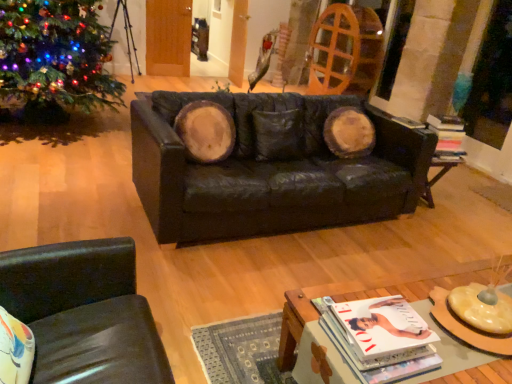
The width and height of the screenshot is (512, 384). What are the coordinates of `free space in front of black leather couch at center` in the screenshot? It's located at (249, 285).